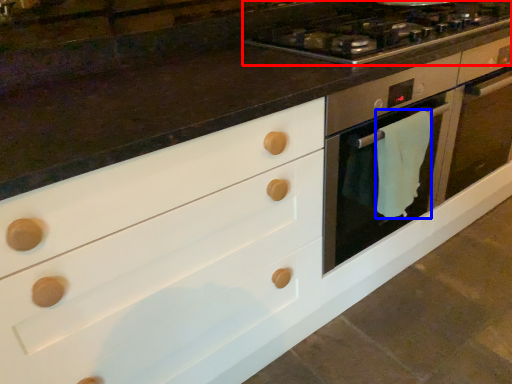
Question: Which object appears closest to the camera in this image, gas stove (highlighted by a red box) or material (highlighted by a blue box)?

Choices:
 (A) gas stove
 (B) material

Answer: (A)